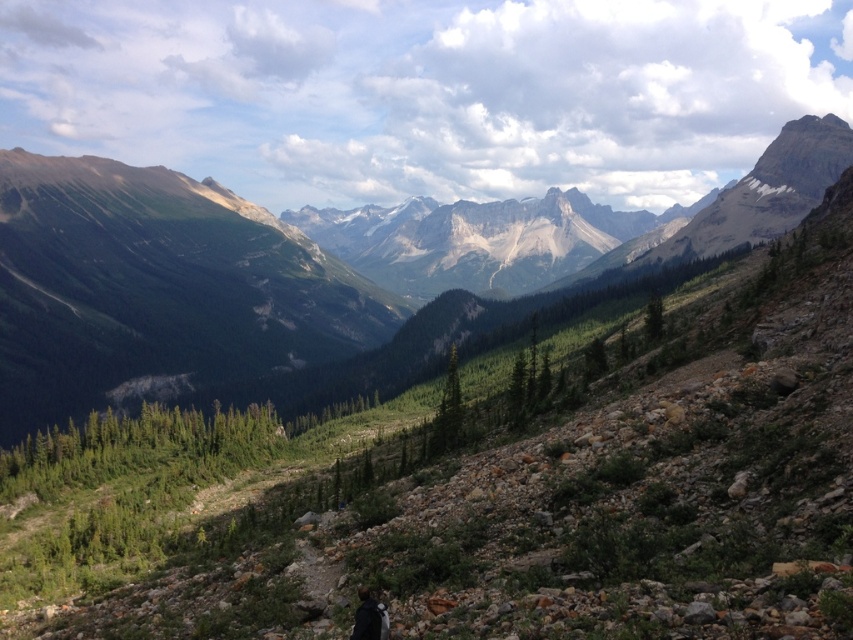
Is green rocky mountain at center smaller than black fabric backpack at lower center?

No, green rocky mountain at center is not smaller than black fabric backpack at lower center.

Is point (277, 234) in front of point (366, 598)?

No, (277, 234) is behind (366, 598).

Which is behind, point (132, 188) or point (379, 616)?

Positioned behind is point (132, 188).

The image size is (853, 640). Find the location of `green rocky mountain at center`. green rocky mountain at center is located at coordinates (161, 292).